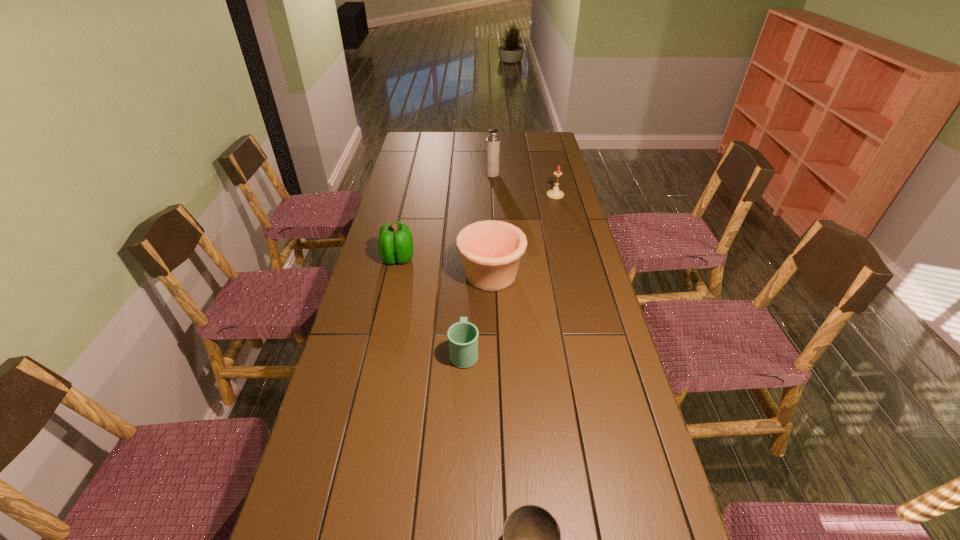
The width and height of the screenshot is (960, 540). What are the coordinates of `vacant area that satisfies the following two spatial constraints: 1. on the side of the second shortest object with the handle; 2. on the right side of the thermos bottle` in the screenshot? It's located at (470, 174).